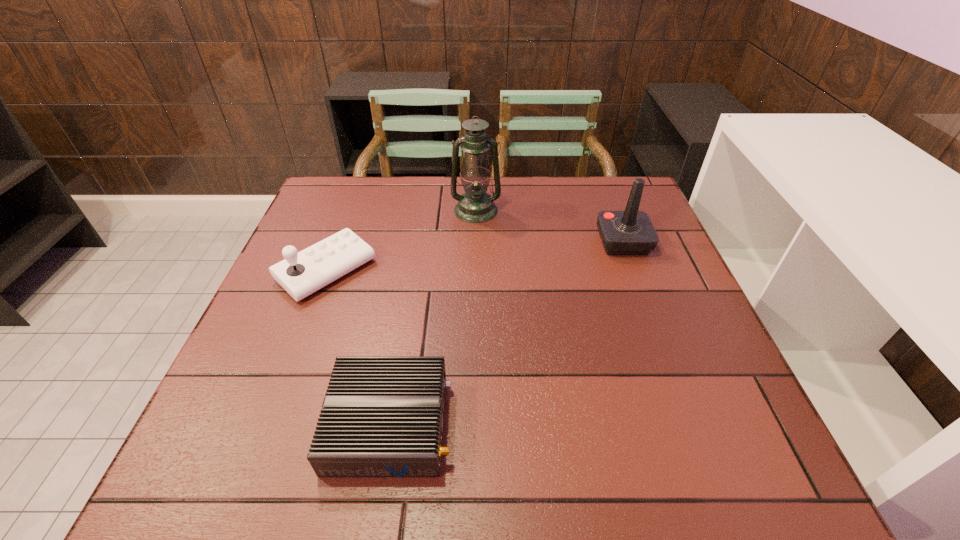
Find the location of a particular element. vacant area situated 0.070m on the right of the shorter joystick is located at coordinates (402, 271).

Locate an element on the screen. The height and width of the screenshot is (540, 960). vacant space located on the back panel of the nearest object is located at coordinates (552, 424).

Locate an element on the screen. The width and height of the screenshot is (960, 540). object that is positioned at the far edge is located at coordinates (475, 206).

Image resolution: width=960 pixels, height=540 pixels. I want to click on object that is at the near edge, so click(382, 416).

Locate an element on the screen. The image size is (960, 540). object situated at the left edge is located at coordinates (302, 273).

At what (x,y) coordinates should I click in order to perform the action: click on object that is positioned at the right edge. Please return your answer as a coordinate pair (x, y). The width and height of the screenshot is (960, 540). Looking at the image, I should click on (631, 232).

The width and height of the screenshot is (960, 540). Identify the location of vacant space at the far edge of the desktop. (386, 186).

Find the location of `vacant region at the left edge`. vacant region at the left edge is located at coordinates (257, 313).

Image resolution: width=960 pixels, height=540 pixels. Identify the location of blank space at the right edge of the desktop. (715, 370).

Where is `free region at the far left corner of the desktop`? free region at the far left corner of the desktop is located at coordinates (346, 210).